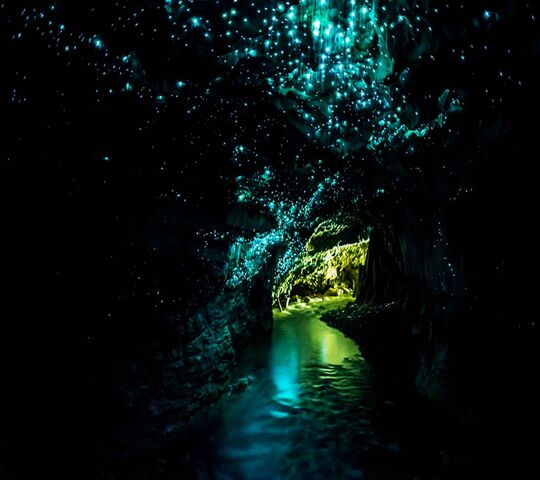
I want to click on neon blue on wall, so click(x=261, y=249), click(x=272, y=219), click(x=300, y=207).